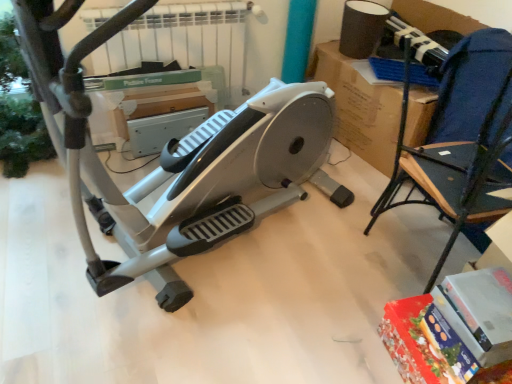
What is the approximate width of silver/grey plastic stationary bicycle at center?

It is 1.40 meters.

The height and width of the screenshot is (384, 512). Identify the location of silver/grey plastic stationary bicycle at center. (178, 158).

Describe the element at coordinates (178, 158) in the screenshot. I see `silver/grey plastic stationary bicycle at center` at that location.

This screenshot has height=384, width=512. I want to click on blue fabric chair at right, so click(x=462, y=139).

Image resolution: width=512 pixels, height=384 pixels. What do you see at coordinates (462, 139) in the screenshot?
I see `blue fabric chair at right` at bounding box center [462, 139].

Identify the location of silver/grey plastic stationary bicycle at center. Image resolution: width=512 pixels, height=384 pixels. [x=178, y=158].

Which is more to the left, blue fabric chair at right or silver/grey plastic stationary bicycle at center?

silver/grey plastic stationary bicycle at center.

Which is in front, blue fabric chair at right or silver/grey plastic stationary bicycle at center?

Positioned in front is silver/grey plastic stationary bicycle at center.

Between point (501, 166) and point (71, 2), which one is positioned in front?

The point (71, 2) is in front.

From the image's perspective, is blue fabric chair at right beneath silver/grey plastic stationary bicycle at center?

Correct, blue fabric chair at right appears lower than silver/grey plastic stationary bicycle at center in the image.

From a real-world perspective, does blue fabric chair at right stand above silver/grey plastic stationary bicycle at center?

No, from a real-world perspective, blue fabric chair at right is not over silver/grey plastic stationary bicycle at center

In the scene shown: Is blue fabric chair at right wider or thinner than silver/grey plastic stationary bicycle at center?

blue fabric chair at right is thinner than silver/grey plastic stationary bicycle at center.

Which of these two, blue fabric chair at right or silver/grey plastic stationary bicycle at center, stands taller?

silver/grey plastic stationary bicycle at center.

Considering the sizes of blue fabric chair at right and silver/grey plastic stationary bicycle at center in the image, is blue fabric chair at right bigger or smaller than silver/grey plastic stationary bicycle at center?

Clearly, blue fabric chair at right is smaller in size than silver/grey plastic stationary bicycle at center.

Based on the photo, does blue fabric chair at right contain silver/grey plastic stationary bicycle at center?

No.

Can you see blue fabric chair at right touching silver/grey plastic stationary bicycle at center?

No, blue fabric chair at right is not making contact with silver/grey plastic stationary bicycle at center.

Is blue fabric chair at right facing away from silver/grey plastic stationary bicycle at center?

No.

How many degrees apart are the facing directions of blue fabric chair at right and silver/grey plastic stationary bicycle at center?

blue fabric chair at right and silver/grey plastic stationary bicycle at center are facing 24.1 degrees away from each other.

How distant is blue fabric chair at right from silver/grey plastic stationary bicycle at center?

blue fabric chair at right is 27.75 inches from silver/grey plastic stationary bicycle at center.

Find the location of a particular element. The height and width of the screenshot is (384, 512). stationary bicycle that is above the blue fabric chair at right (from a real-world perspective) is located at coordinates (178, 158).

Considering the relative positions of silver/grey plastic stationary bicycle at center and blue fabric chair at right in the image provided, is silver/grey plastic stationary bicycle at center to the left or to the right of blue fabric chair at right?

In the image, silver/grey plastic stationary bicycle at center appears on the left side of blue fabric chair at right.

Which object is closer to the camera taking this photo, silver/grey plastic stationary bicycle at center or blue fabric chair at right?

silver/grey plastic stationary bicycle at center is in front.

Which point is more forward, [165,209] or [511,70]?

Positioned in front is point [511,70].

From the image's perspective, which one is positioned lower, silver/grey plastic stationary bicycle at center or blue fabric chair at right?

blue fabric chair at right appears lower in the image.

From a real-world perspective, is silver/grey plastic stationary bicycle at center under blue fabric chair at right?

No, from a real-world perspective, silver/grey plastic stationary bicycle at center is not beneath blue fabric chair at right.

Is silver/grey plastic stationary bicycle at center thinner than blue fabric chair at right?

No, silver/grey plastic stationary bicycle at center is not thinner than blue fabric chair at right.

Based on the photo, considering the sizes of objects silver/grey plastic stationary bicycle at center and blue fabric chair at right in the image provided, who is taller, silver/grey plastic stationary bicycle at center or blue fabric chair at right?

silver/grey plastic stationary bicycle at center is taller.

Based on their sizes in the image, would you say silver/grey plastic stationary bicycle at center is bigger or smaller than blue fabric chair at right?

Considering their sizes, silver/grey plastic stationary bicycle at center takes up more space than blue fabric chair at right.

Is silver/grey plastic stationary bicycle at center situated inside blue fabric chair at right or outside?

silver/grey plastic stationary bicycle at center is outside blue fabric chair at right.

Would you consider silver/grey plastic stationary bicycle at center to be distant from blue fabric chair at right?

Actually, silver/grey plastic stationary bicycle at center and blue fabric chair at right are a little close together.

Does silver/grey plastic stationary bicycle at center turn towards blue fabric chair at right?

No, silver/grey plastic stationary bicycle at center is not aimed at blue fabric chair at right.

At what (x,y) coordinates should I click in order to perform the action: click on stationary bicycle that is on the left side of blue fabric chair at right. Please return your answer as a coordinate pair (x, y). The height and width of the screenshot is (384, 512). Looking at the image, I should click on (178, 158).

Find the location of a particular element. Image resolution: width=512 pixels, height=384 pixels. stationary bicycle that appears in front of the blue fabric chair at right is located at coordinates [x=178, y=158].

Find the location of a particular element. stationary bicycle above the blue fabric chair at right (from the image's perspective) is located at coordinates (178, 158).